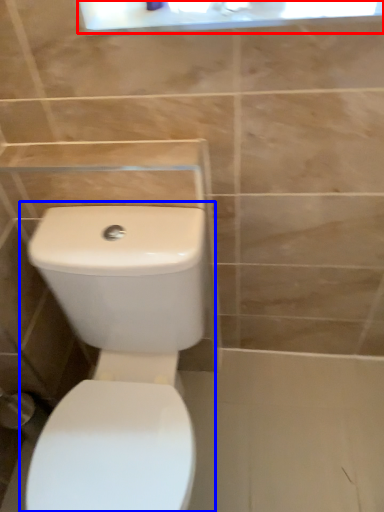
Question: Which point is closer to the camera, medicine cabinet (highlighted by a red box) or toilet (highlighted by a blue box)?

Choices:
 (A) medicine cabinet
 (B) toilet

Answer: (B)